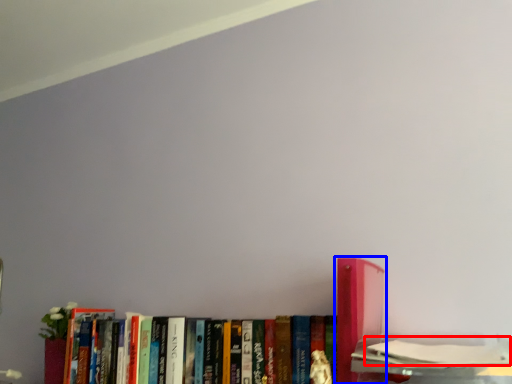
Question: Among these objects, which one is nearest to the camera, book (highlighted by a red box) or book (highlighted by a blue box)?

Choices:
 (A) book
 (B) book

Answer: (A)